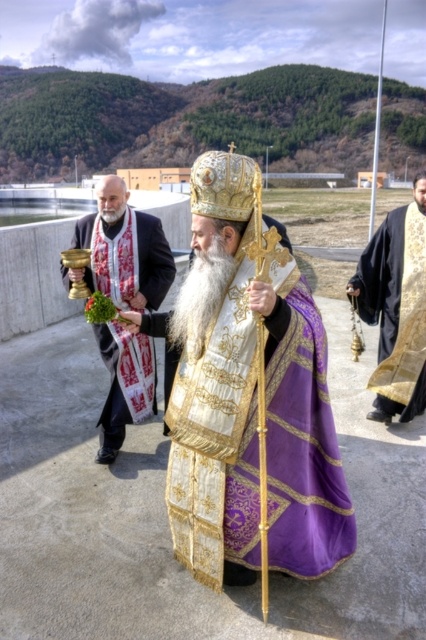
You are an artist trying to draw this scene accurately. Based on the image, which of the two robes, the purple silk robe at center or the black velvet robe at right, should you depict as larger in your drawing?

The purple silk robe at center should be depicted as larger than the black velvet robe at right in the drawing since it is much taller according to the description.

Looking at this image, you are taking a photo of the scene and want to focus on both point [144,227] and point [419,372]. Which point should you focus on first to ensure both are in sharp focus?

You should focus on point [144,227] first because it is closer to the camera than point [419,372]. By focusing on the closer point, the farther point will also be in focus due to the depth of field.

In the religious ceremony scene, there is a purple silk robe at center and a gold metallic chalice at left. Which object is shorter?

The purple silk robe at center is shorter than the gold metallic chalice at left.